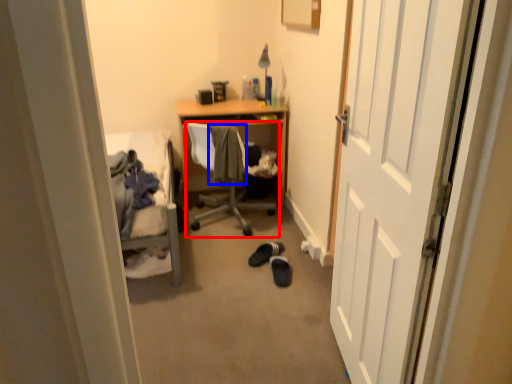
Question: Which of the following is the closest to the observer, chair (highlighted by a red box) or clothing (highlighted by a blue box)?

Choices:
 (A) chair
 (B) clothing

Answer: (A)